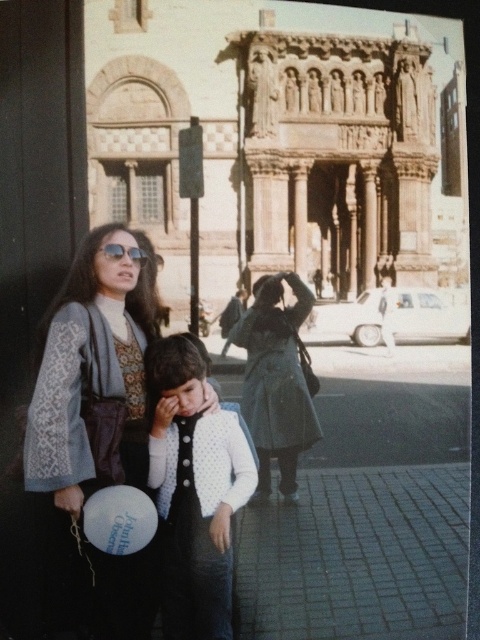
You are a photographer trying to capture the historic building in the background while ensuring the white dotted cardigan at center is visible in the frame. Based on its position, where should you aim your camera to include both the building and the cardigan?

To include both the historic building and the white dotted cardigan at center, aim your camera towards the central area where the cardigan is located at point (193,492). This position will allow the building in the background to remain in view while capturing the cardigan in the foreground.

You are a photographer standing in front of the historic building. You want to take a photo of the matte gray sweater at left. Where should you position your camera to capture it in the frame?

The matte gray sweater at left is located at the 2D coordinates point [93,435], so position your camera to focus on that point to capture it in the frame.

You are standing in front of the historic building and see two points marked on the ground. The first point is at coordinates point (290, 381) and the second is at point (111, 243). Which point is closer to you?

Point (290, 381) is further to the camera than point (111, 243), so the point closer to you is point (111, 243).